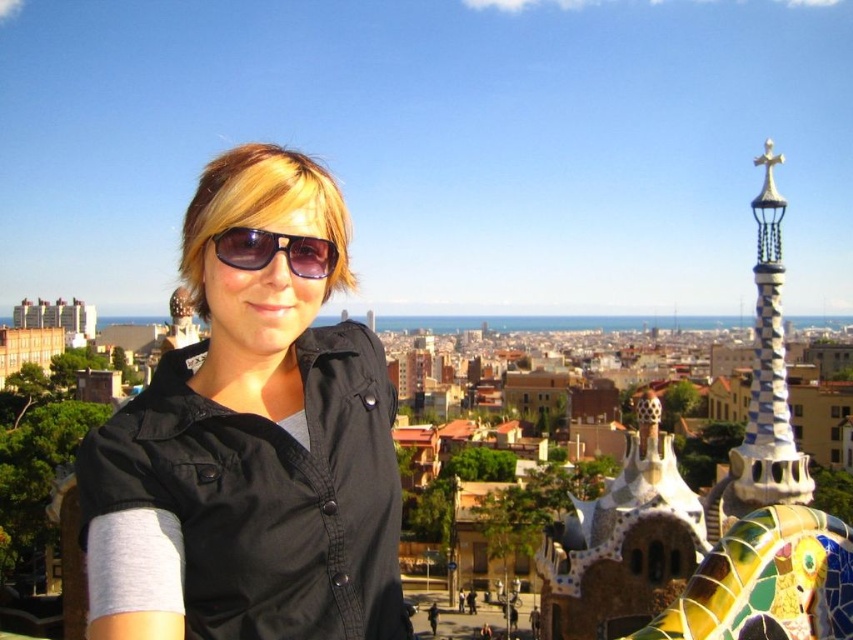
Which of these two, black matte shirt at center or multicolored mosaic spire at upper right, stands shorter?

black matte shirt at center is shorter.

Which is more to the left, black matte shirt at center or multicolored mosaic spire at upper right?

Positioned to the left is black matte shirt at center.

Where is `black matte shirt at center`? The image size is (853, 640). black matte shirt at center is located at coordinates (254, 442).

The image size is (853, 640). What are the coordinates of `black matte shirt at center` in the screenshot? It's located at (254, 442).

Is multicolored mosaic spire at upper right in front of matte black sunglasses at center?

No, multicolored mosaic spire at upper right is further to the viewer.

Is multicolored mosaic spire at upper right bigger than matte black sunglasses at center?

Yes, multicolored mosaic spire at upper right is bigger than matte black sunglasses at center.

Is point (804, 497) farther from camera compared to point (325, 273)?

Yes, it is.

At what (x,y) coordinates should I click in order to perform the action: click on multicolored mosaic spire at upper right. Please return your answer as a coordinate pair (x, y). The height and width of the screenshot is (640, 853). Looking at the image, I should click on (763, 387).

Can you confirm if black matte shirt at center is positioned below matte black sunglasses at center?

Correct, black matte shirt at center is located below matte black sunglasses at center.

Is point (149, 433) behind point (325, 273)?

No, it is not.

Image resolution: width=853 pixels, height=640 pixels. What do you see at coordinates (254, 442) in the screenshot?
I see `black matte shirt at center` at bounding box center [254, 442].

Locate an element on the screen. black matte shirt at center is located at coordinates (254, 442).